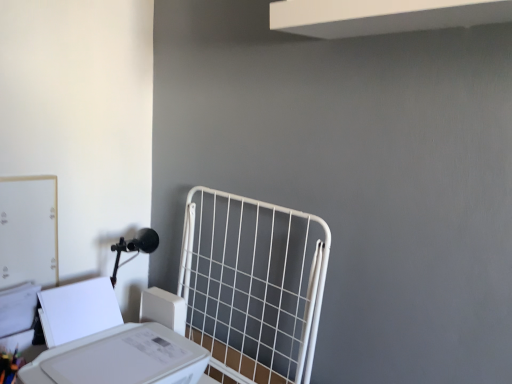
What do you see at coordinates (113, 339) in the screenshot? I see `white plastic printer at lower left` at bounding box center [113, 339].

You are a GUI agent. You are given a task and a screenshot of the screen. Output one action in this format:
    pyautogui.click(x=<x>, y=<y>)
    Task: Click on the white plastic printer at lower left
    The image size is (512, 384).
    Given the screenshot: What is the action you would take?
    pyautogui.click(x=113, y=339)

Identify the location of white plastic printer at lower left. The height and width of the screenshot is (384, 512). (113, 339).